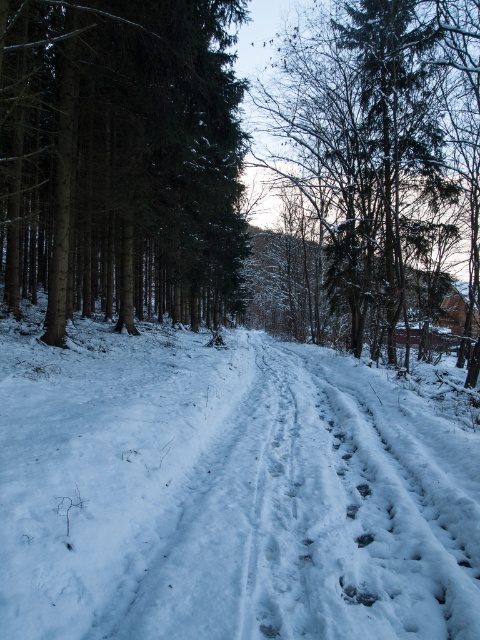
Does green matte tree at left have a lesser width compared to snow-covered tree at center?

Yes, green matte tree at left is thinner than snow-covered tree at center.

Is point (146, 241) positioned behind point (431, 314)?

Yes, point (146, 241) is farther from viewer.

From the picture: Who is more distant from viewer, (134, 118) or (345, 220)?

Positioned behind is point (345, 220).

The height and width of the screenshot is (640, 480). Find the location of `green matte tree at left`. green matte tree at left is located at coordinates (121, 160).